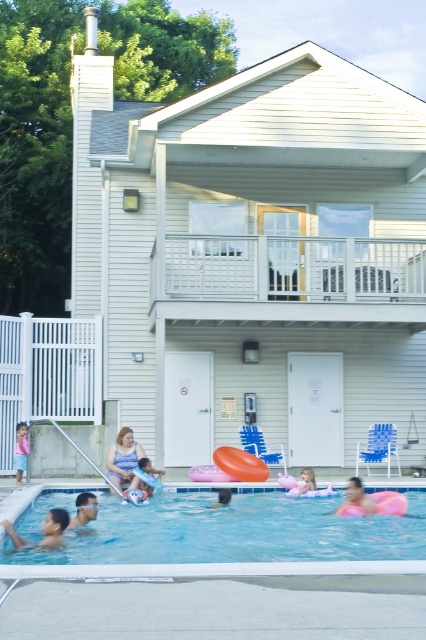
You are standing at the edge of the pool and want to see where the transparent blue water at lower center is located. According to the coordinates given, where exactly is it positioned?

The transparent blue water at lower center is positioned at coordinates point [227,541].

You are a lifeguard observing the pool area. You notice the blue denim shorts at lower left and the smooth pink float at center. Which object is located closer to the edge of the pool?

The blue denim shorts at lower left is positioned over the smooth pink float at center, meaning it is closer to the edge of the pool.

You are a swimmer trying to reach the edge of the pool. You see the transparent blue water at lower center and the matte pink float at center. Which object is closer to the pool edge?

The matte pink float at center is closer to the pool edge because the transparent blue water at lower center is positioned on its right side, meaning the float is nearer to the edge.